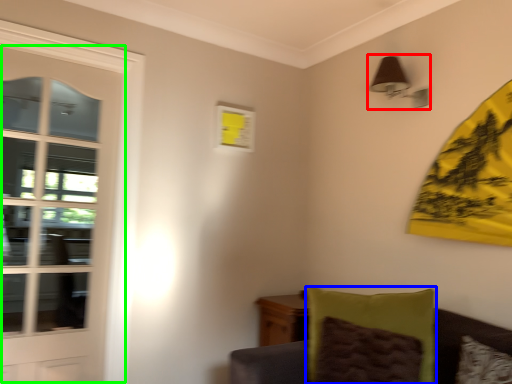
Question: Based on their relative distances, which object is nearer to light fixture (highlighted by a red box)? Choose from pillow (highlighted by a blue box) and door (highlighted by a green box).

Choices:
 (A) pillow
 (B) door

Answer: (A)